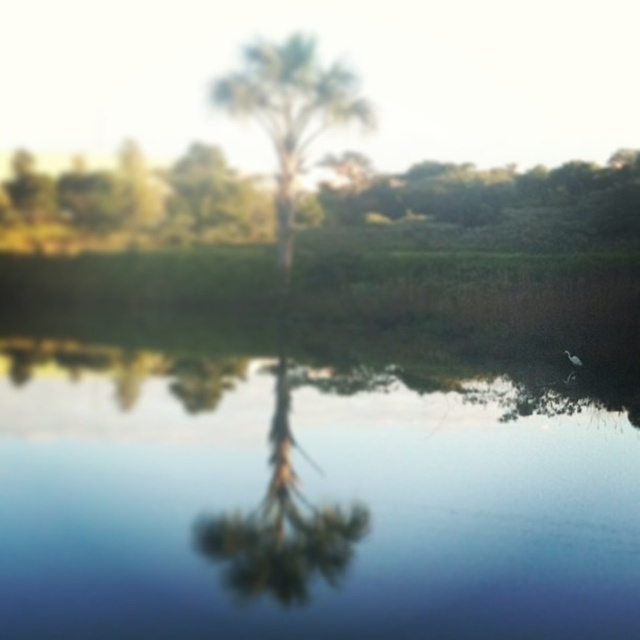
You are standing on the edge of the water and want to compare the height of the transparent blue water at center and the green leafy tree at center. Which one is taller?

The green leafy tree at center is taller than the transparent blue water at center.

You are standing at the point with coordinates point (29, 330) and want to walk towards the point with coordinates point (305, 506). Will you be able to see the palm tree in the background during your walk?

Yes, because point (29, 330) is behind point (305, 506), so the palm tree in the background will remain visible as you walk towards the destination point.